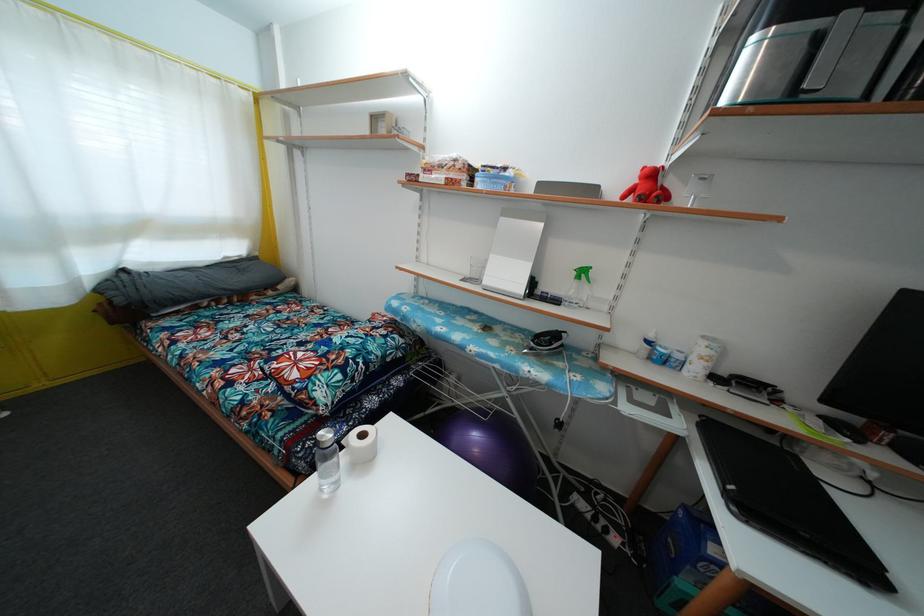
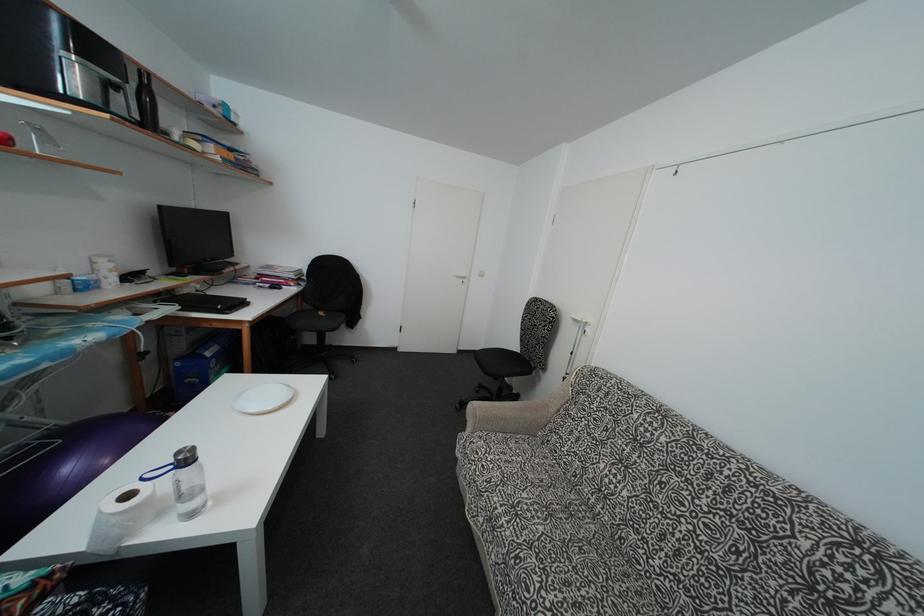
In the second image, find the point that corresponds to (825,453) in the first image.

(185, 294)